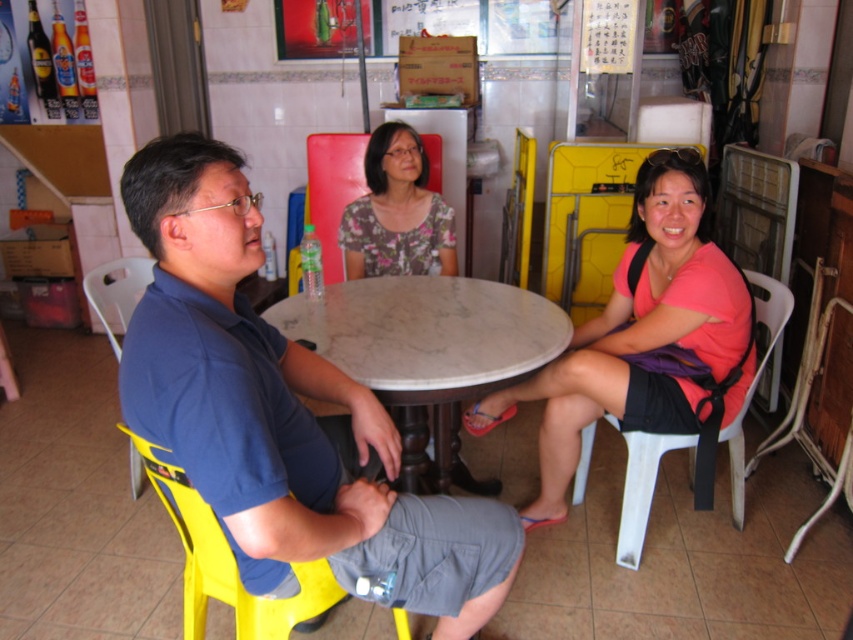
What is located at the coordinates point (641, 336)?

The coordinates point (641, 336) indicate the location of the pink fabric shirt at center.

You are organizing a charity clothing drive and need to determine which items are suitable for adults. Based on the image, which clothing item is more likely to fit an adult? Please choose between the pink fabric shirt at center and the floral fabric blouse at center.

The pink fabric shirt at center is bigger than the floral fabric blouse at center, so it is more likely to fit an adult.